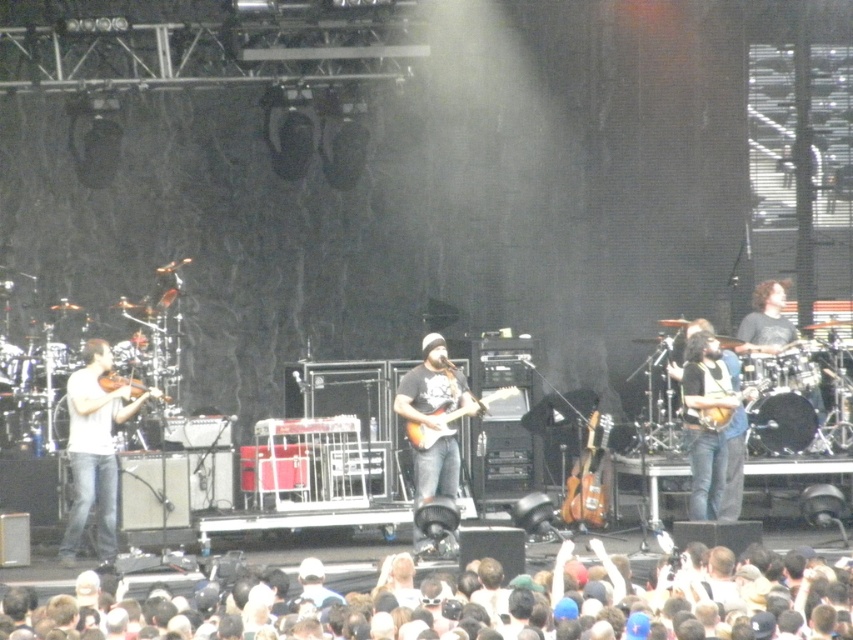
You are a photographer trying to capture the crowd and the lead guitarist during the concert. Based on the scene, can you determine if the white cotton crowd at lower center is to the right or left of the wooden electric guitar at center?

The white cotton crowd at lower center is positioned on the right side of wooden electric guitar at center.

You are a stagehand setting up microphones for the violinists. The white matte violin at left and the matte brown violin at left are both on the stage. Which violin should you place the taller microphone stand under to accommodate their instrument height?

The white matte violin at left has a greater height compared to the matte brown violin at left, so you should place the taller microphone stand under the white matte violin at left to accommodate its height.